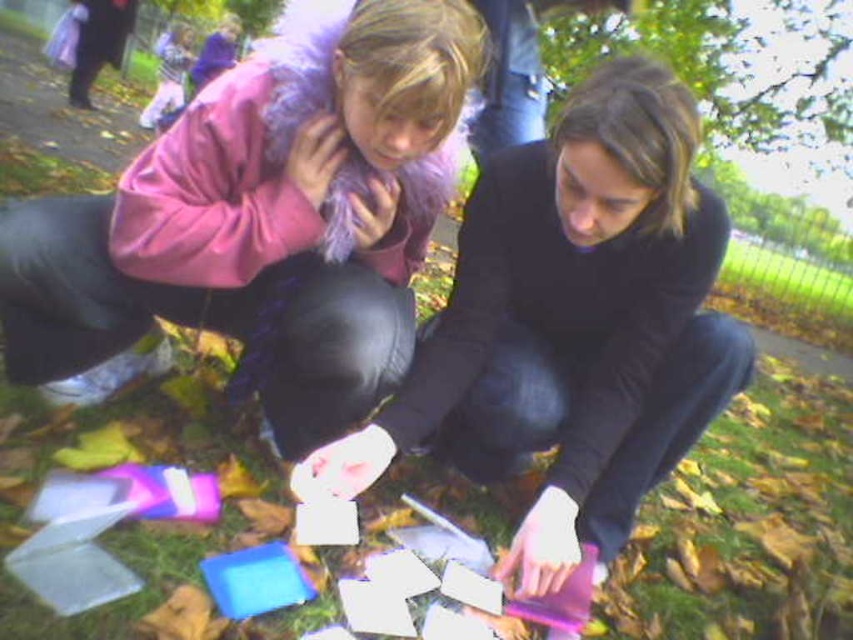
Who is positioned more to the right, matte black jacket at center or purple glossy phone at lower center?

purple glossy phone at lower center

Locate an element on the screen. The image size is (853, 640). matte black jacket at center is located at coordinates (573, 323).

Is pink fur coat at upper left smaller than purple glossy phone at lower center?

No, pink fur coat at upper left is not smaller than purple glossy phone at lower center.

Does pink fur coat at upper left lie in front of purple glossy phone at lower center?

Yes.

What do you see at coordinates (262, 221) in the screenshot? I see `pink fur coat at upper left` at bounding box center [262, 221].

Locate an element on the screen. This screenshot has height=640, width=853. pink fur coat at upper left is located at coordinates (262, 221).

Between pink fur coat at upper left and matte black jacket at center, which one is positioned higher?

Positioned higher is pink fur coat at upper left.

Does pink fur coat at upper left have a lesser width compared to matte black jacket at center?

No.

Between point (149, 189) and point (607, 61), which one is positioned in front?

Point (149, 189) is in front.

This screenshot has height=640, width=853. What are the coordinates of `pink fur coat at upper left` in the screenshot? It's located at (262, 221).